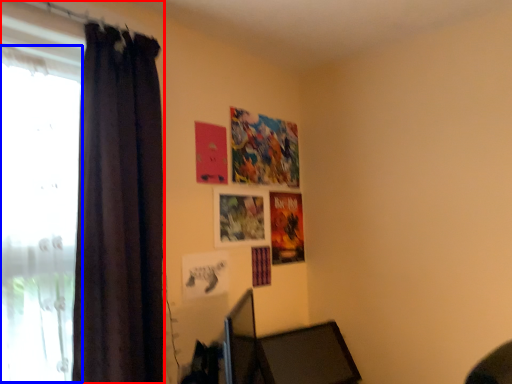
Question: Among these objects, which one is nearest to the camera, curtain (highlighted by a red box) or window (highlighted by a blue box)?

Choices:
 (A) curtain
 (B) window

Answer: (B)